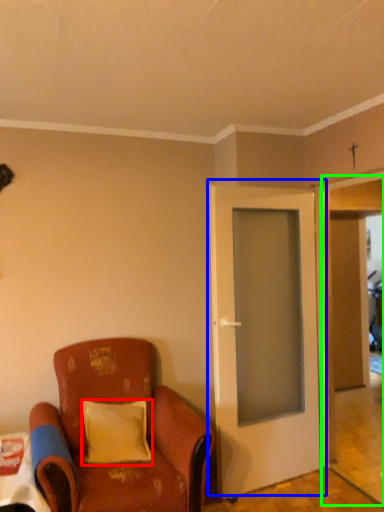
Question: Which object is positioned farthest from pillow (highlighted by a red box)? Select from door (highlighted by a blue box) and garage door (highlighted by a green box).

Choices:
 (A) door
 (B) garage door

Answer: (B)